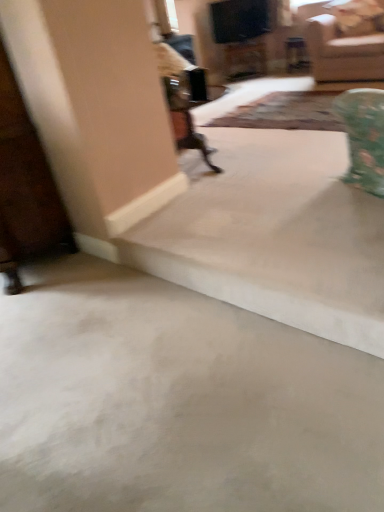
Question: Is beige smooth concrete at lower center in contact with beige fabric couch at upper right?

Choices:
 (A) yes
 (B) no

Answer: (B)

Question: From the image's perspective, is beige smooth concrete at lower center on top of beige fabric couch at upper right?

Choices:
 (A) yes
 (B) no

Answer: (B)

Question: Considering the relative sizes of beige smooth concrete at lower center and beige fabric couch at upper right in the image provided, is beige smooth concrete at lower center bigger than beige fabric couch at upper right?

Choices:
 (A) no
 (B) yes

Answer: (A)

Question: From a real-world perspective, is beige smooth concrete at lower center positioned under beige fabric couch at upper right based on gravity?

Choices:
 (A) yes
 (B) no

Answer: (A)

Question: Is beige smooth concrete at lower center not inside beige fabric couch at upper right?

Choices:
 (A) yes
 (B) no

Answer: (A)

Question: In terms of width, does beige fabric couch at upper right look wider or thinner when compared to patterned fabric mat at center?

Choices:
 (A) wide
 (B) thin

Answer: (B)

Question: Considering the relative positions of beige fabric couch at upper right and patterned fabric mat at center in the image provided, is beige fabric couch at upper right to the left or to the right of patterned fabric mat at center?

Choices:
 (A) left
 (B) right

Answer: (B)

Question: Is beige fabric couch at upper right inside the boundaries of patterned fabric mat at center, or outside?

Choices:
 (A) inside
 (B) outside

Answer: (B)

Question: Considering their positions, is beige fabric couch at upper right located in front of or behind patterned fabric mat at center?

Choices:
 (A) front
 (B) behind

Answer: (B)

Question: Visually, is beige smooth concrete at lower center positioned to the left or to the right of beige fabric couch at upper right?

Choices:
 (A) left
 (B) right

Answer: (A)

Question: From a real-world perspective, relative to beige fabric couch at upper right, is beige smooth concrete at lower center vertically above or below?

Choices:
 (A) below
 (B) above

Answer: (A)

Question: In terms of height, does beige smooth concrete at lower center look taller or shorter compared to beige fabric couch at upper right?

Choices:
 (A) tall
 (B) short

Answer: (B)

Question: From the image's perspective, is beige smooth concrete at lower center positioned above or below beige fabric couch at upper right?

Choices:
 (A) below
 (B) above

Answer: (A)

Question: Relative to beige fabric couch at upper right, is patterned fabric mat at center in front or behind?

Choices:
 (A) behind
 (B) front

Answer: (B)

Question: In terms of size, does patterned fabric mat at center appear bigger or smaller than beige fabric couch at upper right?

Choices:
 (A) big
 (B) small

Answer: (B)